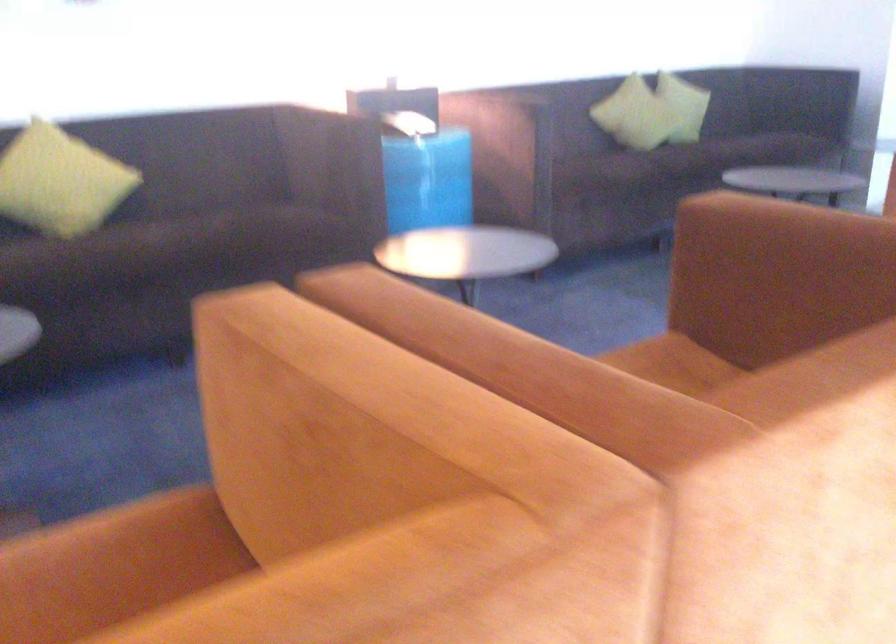
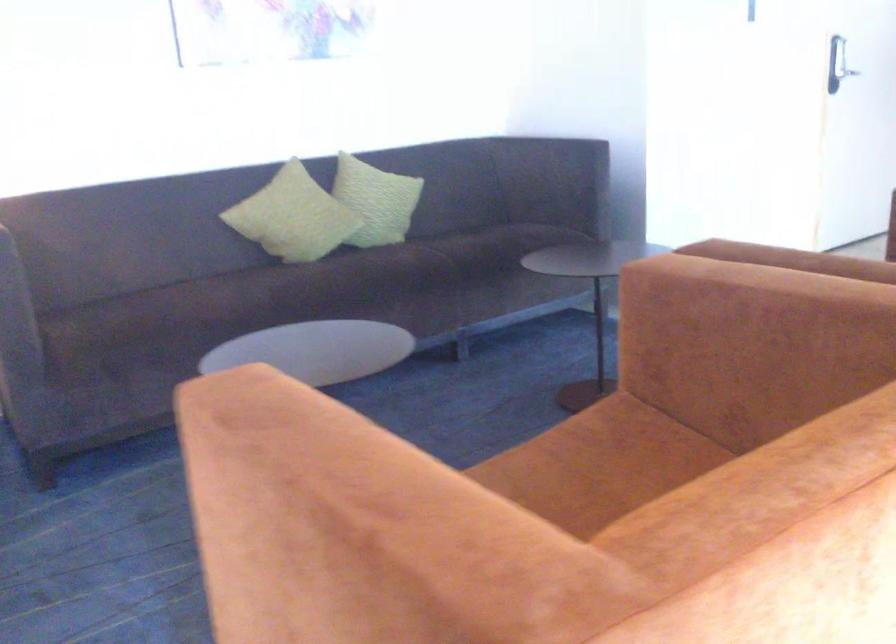
Which direction would the cameraman need to move to produce the second image?

The cameraman moved toward right, forward.